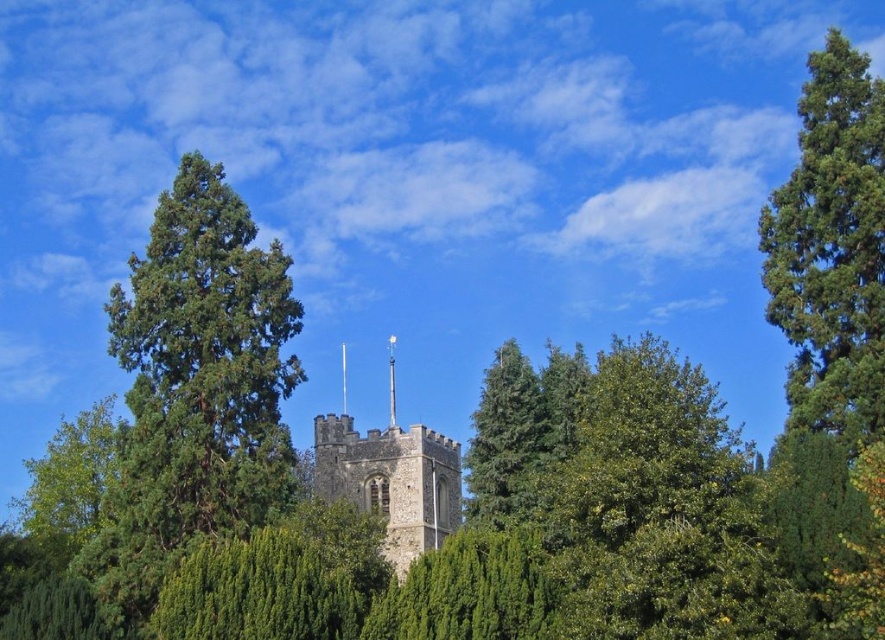
Question: Is green textured tree at center thinner than green leafy tree at left?

Choices:
 (A) yes
 (B) no

Answer: (A)

Question: Which object is positioned farthest from the green textured pine tree at right?

Choices:
 (A) green textured tree at left
 (B) green textured tree at center
 (C) green leafy tree at left

Answer: (C)

Question: Is green textured pine tree at right in front of green leafy tree at left?

Choices:
 (A) no
 (B) yes

Answer: (B)

Question: Which object is the farthest from the green textured pine tree at right?

Choices:
 (A) green leafy tree at left
 (B) green textured tree at left

Answer: (A)

Question: Is green textured tree at left positioned before stone tower at center?

Choices:
 (A) no
 (B) yes

Answer: (B)

Question: Which of the following is the closest to the observer?

Choices:
 (A) (418, 470)
 (B) (485, 420)

Answer: (B)